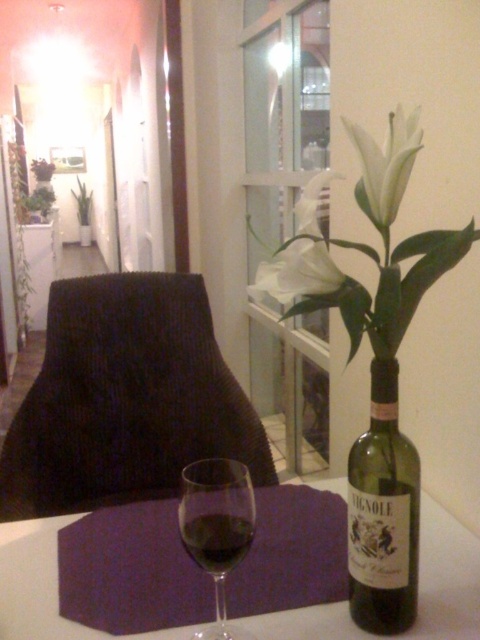
Question: Among these points, which one is farthest from the camera?

Choices:
 (A) (380, 620)
 (B) (192, 518)

Answer: (A)

Question: Does green glass bottle at right appear over translucent glass at center?

Choices:
 (A) no
 (B) yes

Answer: (B)

Question: Which of the following is the closest to the observer?

Choices:
 (A) (228, 518)
 (B) (398, 282)
 (C) (342, 273)

Answer: (A)

Question: Is white glossy table at center smaller than white matte flower at upper center?

Choices:
 (A) yes
 (B) no

Answer: (B)

Question: Is black textured armchair at left below white matte flower at upper center?

Choices:
 (A) yes
 (B) no

Answer: (A)

Question: Among these objects, which one is farthest from the camera?

Choices:
 (A) black textured armchair at left
 (B) transparent glass wine glass at center

Answer: (A)